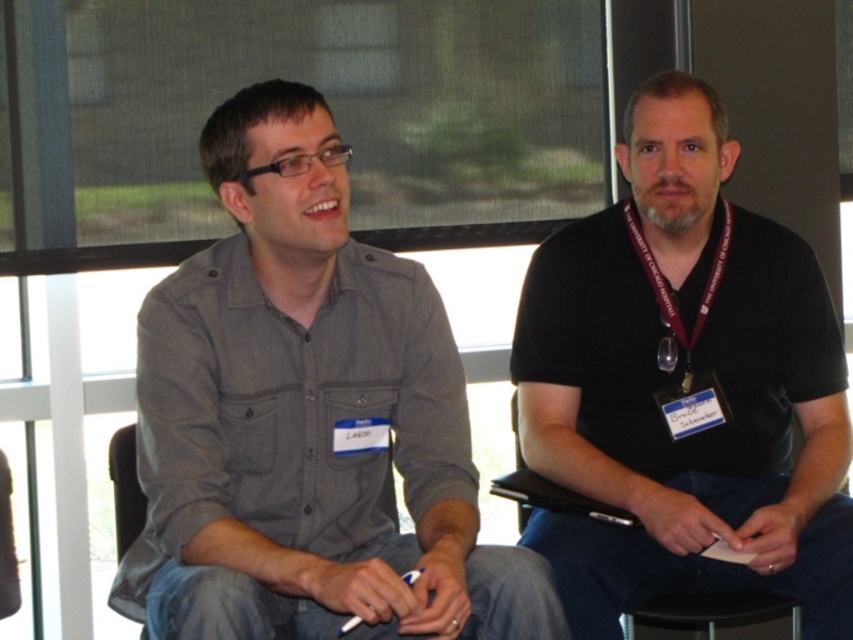
What do you see at coordinates (294, 260) in the screenshot? I see `matte gray shirt at center` at bounding box center [294, 260].

Between matte gray shirt at center and black fabric lanyard at center, which one is positioned higher?

matte gray shirt at center is higher up.

Who is more distant from viewer, (293, 292) or (650, 253)?

Positioned behind is point (650, 253).

Where is `matte gray shirt at center`? matte gray shirt at center is located at coordinates point(294,260).

Does black matte shirt at center appear over matte gray shirt at center?

Actually, black matte shirt at center is below matte gray shirt at center.

How distant is black matte shirt at center from matte gray shirt at center?

33.74 inches

Where is `black matte shirt at center`? black matte shirt at center is located at coordinates (680, 387).

Is point (428, 340) behind point (677, 477)?

No, it is in front of (677, 477).

Does gray cotton shirt at left come behind black matte shirt at center?

No, it is in front of black matte shirt at center.

Locate an element on the screen. This screenshot has height=640, width=853. gray cotton shirt at left is located at coordinates (306, 428).

Where is `gray cotton shirt at left`? The height and width of the screenshot is (640, 853). gray cotton shirt at left is located at coordinates (306, 428).